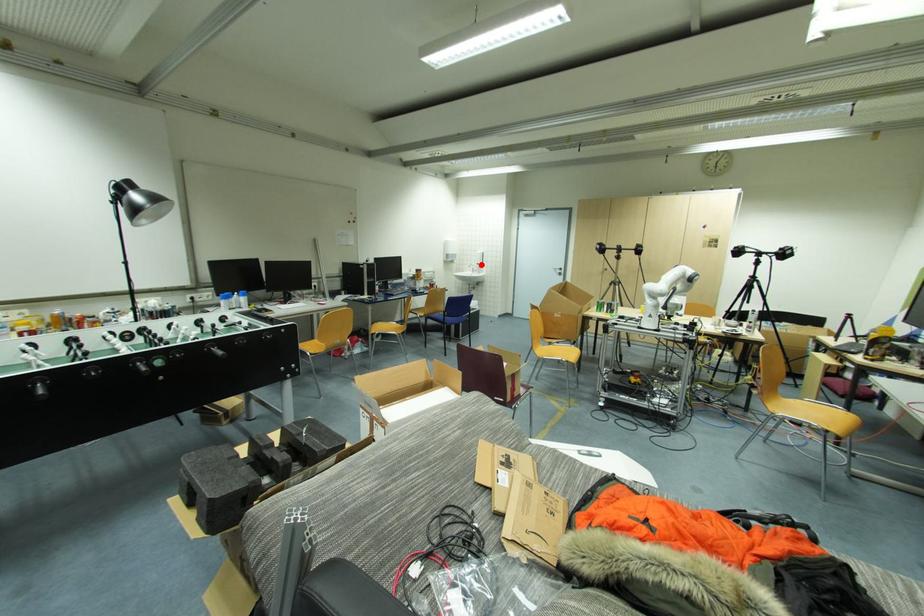
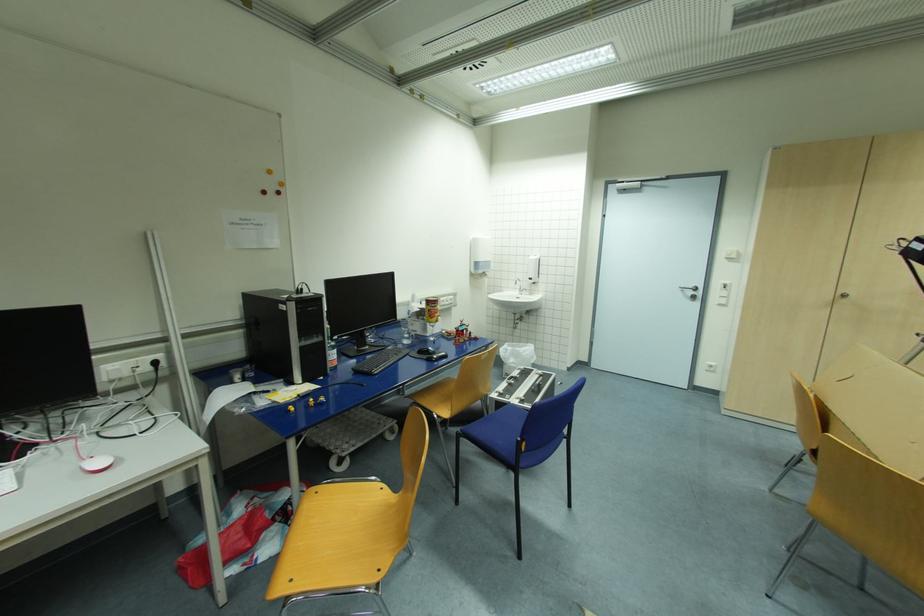
Question: I am providing you with two images of the same scene from different viewpoints. In image1, a red point is highlighted. Considering the same 3D point in image2, which of the following is correct?

Choices:
 (A) It is closer
 (B) It is farther

Answer: (B)